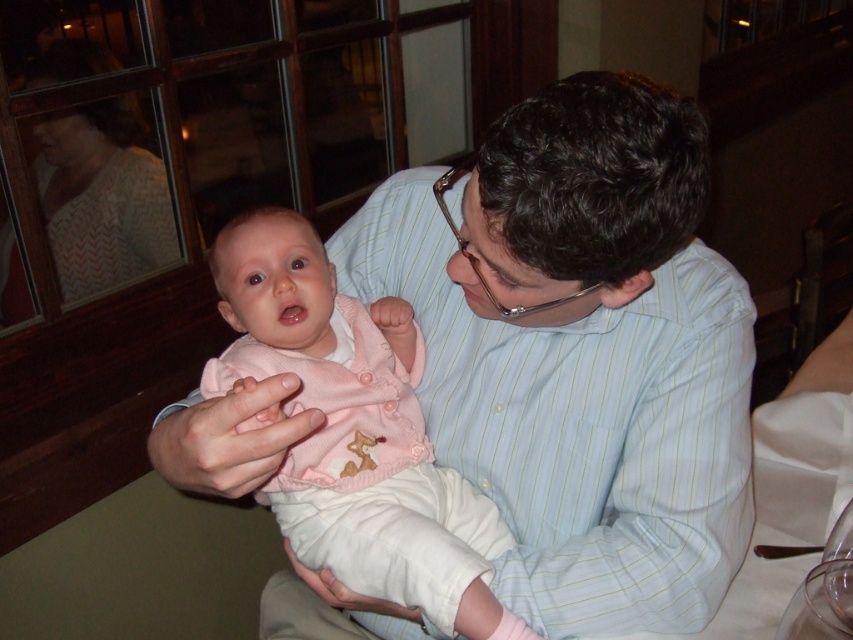
Consider the image. You are a photographer trying to capture a candid shot of the baby in the pink knitted sweater at center without the adult noticing. Since the adult is wearing the light blue striped shirt at center, which is taller than the sweater, where should you position your camera relative to the adult to ensure the baby is visible?

The light blue striped shirt at center is taller than the pink knitted sweater at center, so positioning the camera slightly above the adult will allow you to see the baby in the pink knitted sweater at center while avoiding the adult blocking the view.

Based on the photo, what are the coordinates of the light blue striped shirt at center?

The light blue striped shirt at center is located at coordinates point (581, 352).

You are a photographer trying to capture a closeup shot of both the light blue striped shirt at center and the pink knitted sweater at center. Your camera has a maximum focus range of 5 inches. Can you fit both items within the focus range?

The light blue striped shirt at center and pink knitted sweater at center are 4.99 inches apart, so yes, the camera can capture both within its 5 inch focus range since the distance between them is just under the limit.